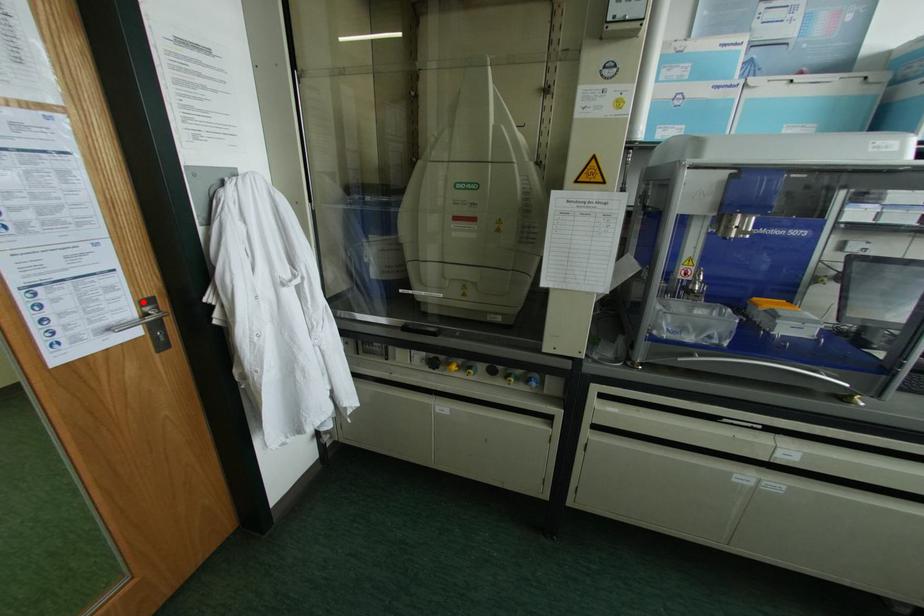
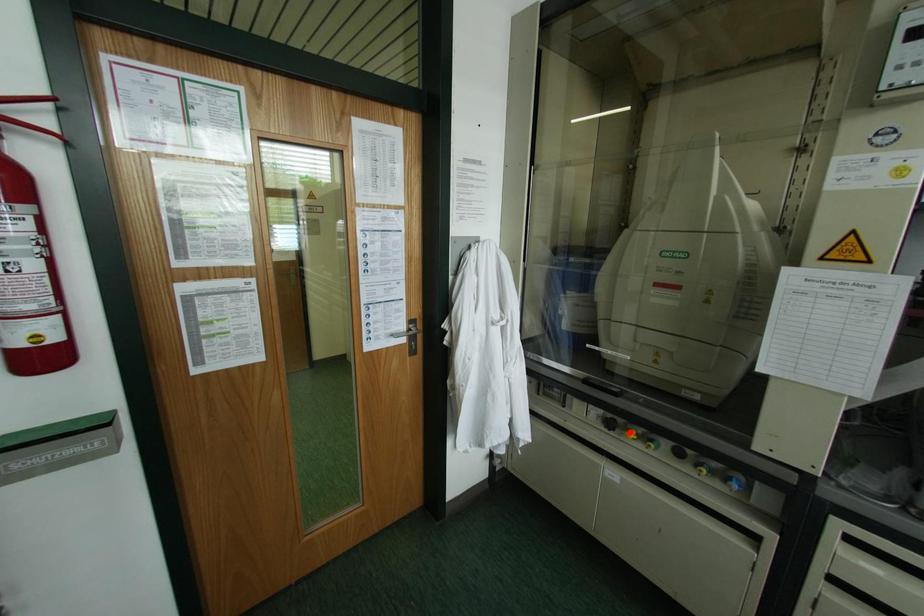
I am providing you with two images of the same scene from different viewpoints. A red point is marked on the first image and another point is marked on the second image. Does the point marked in image1 correspond to the same location as the one in image2?

No